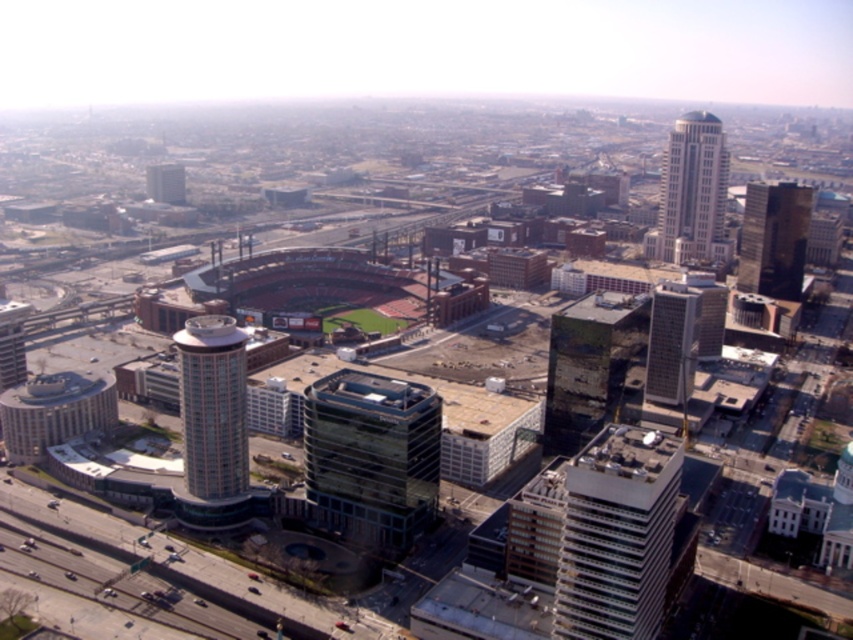
Does green glass building at center appear on the right side of dark gray glass skyscraper at center-right?

In fact, green glass building at center is to the left of dark gray glass skyscraper at center-right.

In the scene shown: Which is more to the right, green glass building at center or dark gray glass skyscraper at center-right?

dark gray glass skyscraper at center-right is more to the right.

Locate an element on the screen. This screenshot has height=640, width=853. green glass building at center is located at coordinates (370, 458).

From the picture: Is rusty metal building at center closer to camera compared to beige glass tower at center?

That is False.

Is rusty metal building at center smaller than beige glass tower at center?

Yes.

This screenshot has height=640, width=853. Identify the location of rusty metal building at center. (590, 365).

The image size is (853, 640). I want to click on rusty metal building at center, so click(590, 365).

Is green glass building at center to the left of beige glass tower at center from the viewer's perspective?

Incorrect, green glass building at center is not on the left side of beige glass tower at center.

Is point (422, 497) positioned behind point (210, 433)?

Yes.

Who is more distant from viewer, (x=378, y=513) or (x=173, y=340)?

The point (x=173, y=340) is more distant.

Image resolution: width=853 pixels, height=640 pixels. I want to click on green glass building at center, so click(x=370, y=458).